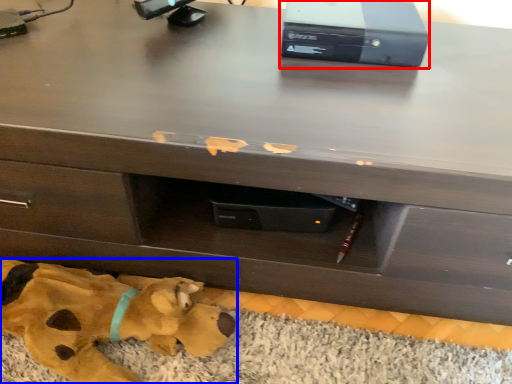
Question: Which object appears closest to the camera in this image, computer (highlighted by a red box) or toy (highlighted by a blue box)?

Choices:
 (A) computer
 (B) toy

Answer: (B)